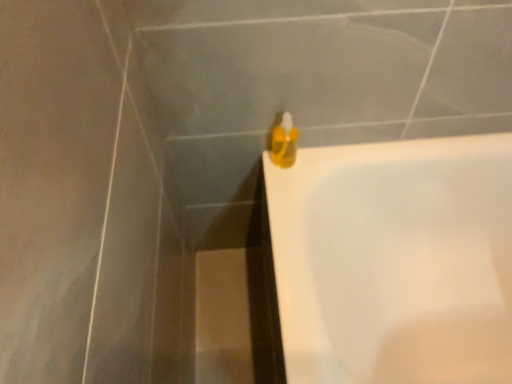
At what (x,y) coordinates should I click in order to perform the action: click on white glossy bathtub at upper right. Please return your answer as a coordinate pair (x, y). Looking at the image, I should click on (395, 261).

This screenshot has width=512, height=384. What do you see at coordinates (395, 261) in the screenshot?
I see `white glossy bathtub at upper right` at bounding box center [395, 261].

What do you see at coordinates (284, 142) in the screenshot? Image resolution: width=512 pixels, height=384 pixels. I see `translucent yellow liquid at upper right` at bounding box center [284, 142].

This screenshot has width=512, height=384. Find the location of `translucent yellow liquid at upper right`. translucent yellow liquid at upper right is located at coordinates (284, 142).

Where is `white glossy bathtub at upper right`? The height and width of the screenshot is (384, 512). white glossy bathtub at upper right is located at coordinates (395, 261).

Which object is positioned more to the right, translucent yellow liquid at upper right or white glossy bathtub at upper right?

From the viewer's perspective, white glossy bathtub at upper right appears more on the right side.

Between translucent yellow liquid at upper right and white glossy bathtub at upper right, which one is positioned in front?

white glossy bathtub at upper right.

Is point (274, 150) closer or farther from the camera than point (484, 377)?

Point (274, 150) appears to be closer to the viewer than point (484, 377).

From the image's perspective, is translucent yellow liquid at upper right positioned above or below white glossy bathtub at upper right?

translucent yellow liquid at upper right is above white glossy bathtub at upper right.

From a real-world perspective, is translucent yellow liquid at upper right physically located above or below white glossy bathtub at upper right?

Clearly, from a real-world perspective, translucent yellow liquid at upper right is above white glossy bathtub at upper right.

Considering the sizes of objects translucent yellow liquid at upper right and white glossy bathtub at upper right in the image provided, who is wider, translucent yellow liquid at upper right or white glossy bathtub at upper right?

Wider between the two is white glossy bathtub at upper right.

Considering the sizes of objects translucent yellow liquid at upper right and white glossy bathtub at upper right in the image provided, who is taller, translucent yellow liquid at upper right or white glossy bathtub at upper right?

white glossy bathtub at upper right is taller.

Which of these two, translucent yellow liquid at upper right or white glossy bathtub at upper right, is bigger?

white glossy bathtub at upper right.

Is translucent yellow liquid at upper right inside or outside of white glossy bathtub at upper right?

translucent yellow liquid at upper right cannot be found inside white glossy bathtub at upper right.

Is translucent yellow liquid at upper right directly adjacent to white glossy bathtub at upper right?

They are not placed beside each other.

Is translucent yellow liquid at upper right oriented towards white glossy bathtub at upper right?

No.

From the picture: How distant is translucent yellow liquid at upper right from white glossy bathtub at upper right?

16.78 inches.

Where is `bathtub located in front of the translucent yellow liquid at upper right`? The width and height of the screenshot is (512, 384). bathtub located in front of the translucent yellow liquid at upper right is located at coordinates (395, 261).

Would you say white glossy bathtub at upper right is to the left or to the right of translucent yellow liquid at upper right in the picture?

Based on their positions, white glossy bathtub at upper right is located to the right of translucent yellow liquid at upper right.

Based on the photo, considering their positions, is white glossy bathtub at upper right located in front of or behind translucent yellow liquid at upper right?

Clearly, white glossy bathtub at upper right is in front of translucent yellow liquid at upper right.

Does point (468, 332) lie in front of point (276, 132)?

No.

From the image's perspective, is white glossy bathtub at upper right on top of translucent yellow liquid at upper right?

No, from the image's perspective, white glossy bathtub at upper right is not above translucent yellow liquid at upper right.

From a real-world perspective, does white glossy bathtub at upper right stand above translucent yellow liquid at upper right?

No.

Considering the sizes of white glossy bathtub at upper right and translucent yellow liquid at upper right in the image, is white glossy bathtub at upper right wider or thinner than translucent yellow liquid at upper right?

Considering their sizes, white glossy bathtub at upper right looks broader than translucent yellow liquid at upper right.

Considering the sizes of objects white glossy bathtub at upper right and translucent yellow liquid at upper right in the image provided, who is shorter, white glossy bathtub at upper right or translucent yellow liquid at upper right?

With less height is translucent yellow liquid at upper right.

Can you confirm if white glossy bathtub at upper right is smaller than translucent yellow liquid at upper right?

No.

Would you say white glossy bathtub at upper right contains translucent yellow liquid at upper right?

No, translucent yellow liquid at upper right is not surrounded by white glossy bathtub at upper right.

Is white glossy bathtub at upper right far away from translucent yellow liquid at upper right?

white glossy bathtub at upper right is actually quite close to translucent yellow liquid at upper right.

Is white glossy bathtub at upper right facing towards translucent yellow liquid at upper right?

No, white glossy bathtub at upper right is not facing towards translucent yellow liquid at upper right.

In the scene shown: What's the angular difference between white glossy bathtub at upper right and translucent yellow liquid at upper right's facing directions?

The angle between the facing direction of white glossy bathtub at upper right and the facing direction of translucent yellow liquid at upper right is 89 degrees.

The width and height of the screenshot is (512, 384). I want to click on liquid above the white glossy bathtub at upper right (from a real-world perspective), so click(x=284, y=142).

What are the coordinates of `liquid that appears on the left of white glossy bathtub at upper right` in the screenshot? It's located at (284, 142).

Find the location of a particular element. This screenshot has height=384, width=512. liquid behind the white glossy bathtub at upper right is located at coordinates (284, 142).